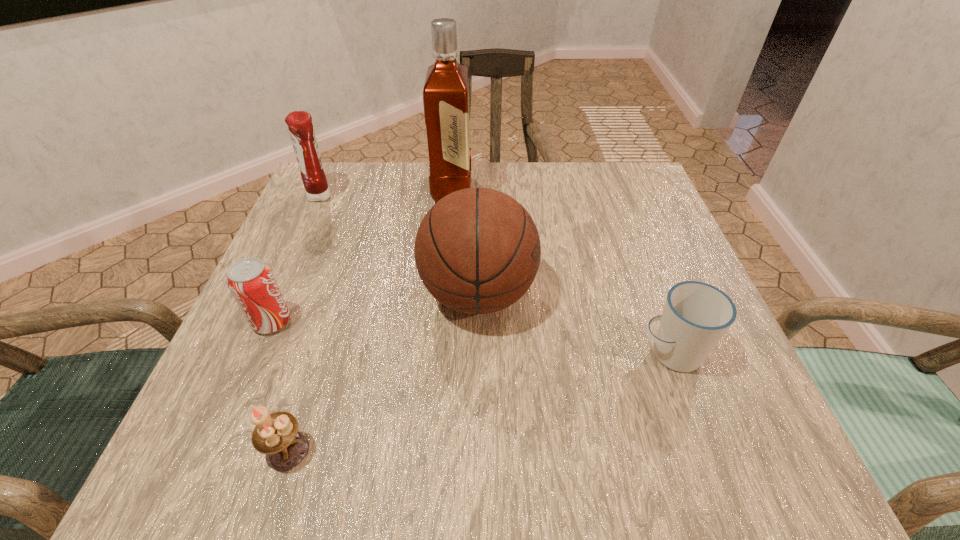
In order to click on vacant area between the soda can and the tallest object in this screenshot , I will do `click(362, 255)`.

Where is `empty location between the basketball and the soda can`? empty location between the basketball and the soda can is located at coordinates (375, 308).

Find the location of `vacant space that is in between the tallest object and the candle holder`. vacant space that is in between the tallest object and the candle holder is located at coordinates (370, 320).

At what (x,y) coordinates should I click in order to perform the action: click on vacant point located between the basketball and the candle holder. Please return your answer as a coordinate pair (x, y). This screenshot has width=960, height=540. Looking at the image, I should click on (383, 372).

At what (x,y) coordinates should I click in order to perform the action: click on free space that is in between the basketball and the soda can. Please return your answer as a coordinate pair (x, y). The image size is (960, 540). Looking at the image, I should click on (375, 308).

The image size is (960, 540). I want to click on vacant area that lies between the basketball and the cup, so click(x=574, y=324).

You are a GUI agent. You are given a task and a screenshot of the screen. Output one action in this format:
    pyautogui.click(x=<x>, y=<y>)
    Task: Click on the blank region between the basketball and the soda can
    The height and width of the screenshot is (540, 960).
    Given the screenshot: What is the action you would take?
    pyautogui.click(x=375, y=308)

The height and width of the screenshot is (540, 960). Find the location of `blank region between the soda can and the liquor`. blank region between the soda can and the liquor is located at coordinates (362, 255).

Find the location of a particular element. object that can be found as the third closest to the tallest object is located at coordinates (252, 283).

Locate an element on the screen. The width and height of the screenshot is (960, 540). object that stands as the closest to the cup is located at coordinates (477, 250).